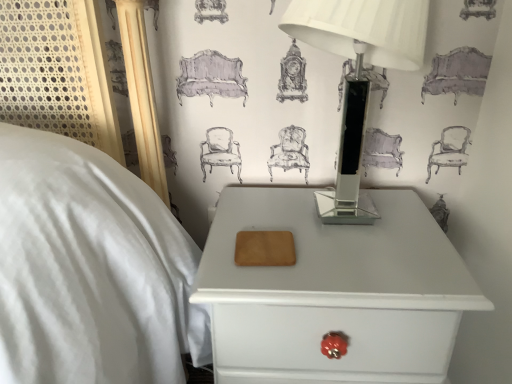
This screenshot has height=384, width=512. I want to click on clear glass table lamp at upper right, so click(358, 74).

The width and height of the screenshot is (512, 384). Describe the element at coordinates (358, 74) in the screenshot. I see `clear glass table lamp at upper right` at that location.

This screenshot has height=384, width=512. Identify the location of white glossy nightstand at lower right. (334, 292).

What do you see at coordinates (334, 292) in the screenshot? This screenshot has height=384, width=512. I see `white glossy nightstand at lower right` at bounding box center [334, 292].

Locate an element on the screen. clear glass table lamp at upper right is located at coordinates (358, 74).

Would you say white glossy nightstand at lower right is to the left or to the right of clear glass table lamp at upper right in the picture?

Clearly, white glossy nightstand at lower right is on the left of clear glass table lamp at upper right in the image.

Considering the relative positions of white glossy nightstand at lower right and clear glass table lamp at upper right in the image provided, is white glossy nightstand at lower right behind clear glass table lamp at upper right?

That is True.

Considering the positions of point (277, 351) and point (358, 95), is point (277, 351) closer or farther from the camera than point (358, 95)?

Point (277, 351) appears to be closer to the viewer than point (358, 95).

From the image's perspective, is white glossy nightstand at lower right beneath clear glass table lamp at upper right?

Yes.

From a real-world perspective, who is located lower, white glossy nightstand at lower right or clear glass table lamp at upper right?

white glossy nightstand at lower right, from a real-world perspective.

Considering the sizes of objects white glossy nightstand at lower right and clear glass table lamp at upper right in the image provided, who is wider, white glossy nightstand at lower right or clear glass table lamp at upper right?

white glossy nightstand at lower right is wider.

Considering the relative sizes of white glossy nightstand at lower right and clear glass table lamp at upper right in the image provided, is white glossy nightstand at lower right taller than clear glass table lamp at upper right?

Yes, white glossy nightstand at lower right is taller than clear glass table lamp at upper right.

Considering the sizes of objects white glossy nightstand at lower right and clear glass table lamp at upper right in the image provided, who is bigger, white glossy nightstand at lower right or clear glass table lamp at upper right?

With larger size is white glossy nightstand at lower right.

Is white glossy nightstand at lower right positioned beyond the bounds of clear glass table lamp at upper right?

white glossy nightstand at lower right is positioned outside clear glass table lamp at upper right.

Would you consider white glossy nightstand at lower right to be distant from clear glass table lamp at upper right?

No, white glossy nightstand at lower right is not far from clear glass table lamp at upper right.

Is white glossy nightstand at lower right aimed at clear glass table lamp at upper right?

No, white glossy nightstand at lower right is not oriented towards clear glass table lamp at upper right.

How many degrees apart are the facing directions of white glossy nightstand at lower right and clear glass table lamp at upper right?

They differ by 3.83 degrees in their facing directions.

Find the location of `nightstand below the clear glass table lamp at upper right (from a real-world perspective)`. nightstand below the clear glass table lamp at upper right (from a real-world perspective) is located at coordinates (334, 292).

Looking at this image, between clear glass table lamp at upper right and white glossy nightstand at lower right, which one appears on the left side from the viewer's perspective?

Positioned to the left is white glossy nightstand at lower right.

Is the depth of clear glass table lamp at upper right greater than that of white glossy nightstand at lower right?

No, clear glass table lamp at upper right is in front of white glossy nightstand at lower right.

Does point (346, 41) come farther from viewer compared to point (362, 318)?

Yes.

From the image's perspective, who appears lower, clear glass table lamp at upper right or white glossy nightstand at lower right?

white glossy nightstand at lower right, from the image's perspective.

From a real-world perspective, is clear glass table lamp at upper right located beneath white glossy nightstand at lower right?

Incorrect, from a real-world perspective, clear glass table lamp at upper right is higher than white glossy nightstand at lower right.

Which of these two, clear glass table lamp at upper right or white glossy nightstand at lower right, is wider?

white glossy nightstand at lower right is wider.

Between clear glass table lamp at upper right and white glossy nightstand at lower right, which one has less height?

clear glass table lamp at upper right is shorter.

Is clear glass table lamp at upper right smaller than white glossy nightstand at lower right?

Yes, clear glass table lamp at upper right is smaller than white glossy nightstand at lower right.

Is clear glass table lamp at upper right spatially inside white glossy nightstand at lower right, or outside of it?

clear glass table lamp at upper right is outside white glossy nightstand at lower right.

Can you see clear glass table lamp at upper right touching white glossy nightstand at lower right?

No, clear glass table lamp at upper right is not making contact with white glossy nightstand at lower right.

Is clear glass table lamp at upper right oriented towards white glossy nightstand at lower right?

No, clear glass table lamp at upper right is not turned towards white glossy nightstand at lower right.

Measure the distance between clear glass table lamp at upper right and white glossy nightstand at lower right.

They are 7.61 inches apart.

Locate an element on the screen. nightstand that is behind the clear glass table lamp at upper right is located at coordinates (334, 292).

Locate an element on the screen. Image resolution: width=512 pixels, height=384 pixels. table lamp above the white glossy nightstand at lower right (from the image's perspective) is located at coordinates (358, 74).

This screenshot has width=512, height=384. I want to click on nightstand on the left side of clear glass table lamp at upper right, so click(334, 292).